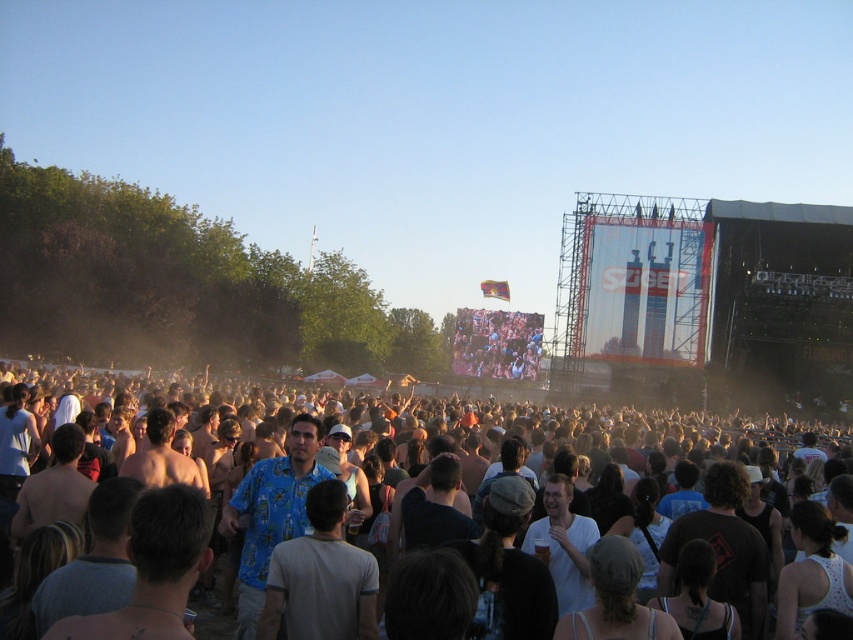
Question: Can you confirm if white cotton shirt at center is positioned below blue printed shirt at center?

Choices:
 (A) yes
 (B) no

Answer: (A)

Question: Which point is farther to the camera?

Choices:
 (A) (675, 449)
 (B) (490, 339)

Answer: (A)

Question: Is white cotton shirt at center thinner than blue printed shirt at center?

Choices:
 (A) yes
 (B) no

Answer: (B)

Question: Which object is closer to the camera taking this photo?

Choices:
 (A) white cotton shirt at center
 (B) blue printed shirt at center

Answer: (A)

Question: Is white cotton shirt at center bigger than blue printed shirt at center?

Choices:
 (A) yes
 (B) no

Answer: (A)